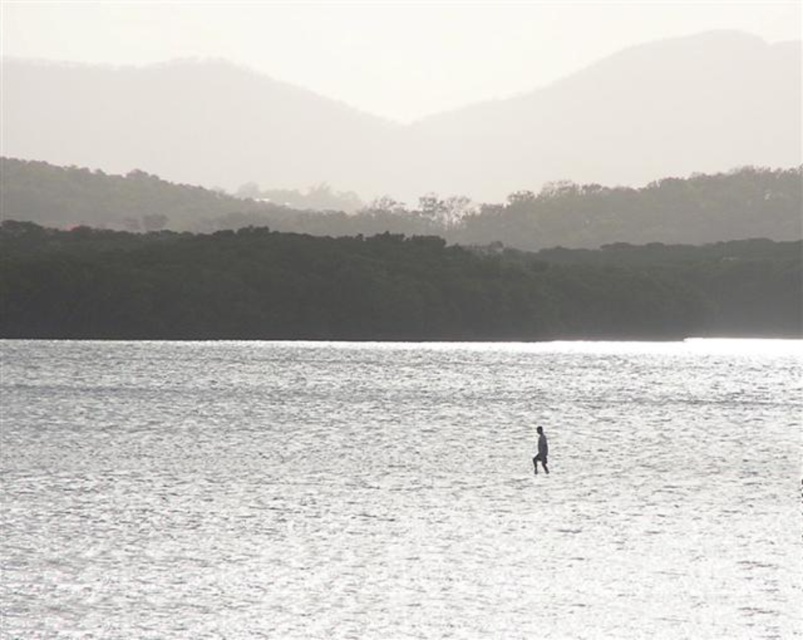
You are a photographer trying to capture the smooth skin figure at center in the clear water at center. Which object should you focus on first to ensure the figure is sharp in your photo?

The clear water at center is larger in size than the smooth skin figure at center, so you should focus on the clear water at center first to ensure the figure is sharp.

You are a photographer trying to capture the smooth skin figure at center in the clear water at center. Since the water is wider than the figure, can you frame the shot so that the figure is centered within the water? Explain how the width difference affects the composition.

The clear water at center is wider than the smooth skin figure at center, so yes, you can frame the shot so that the figure is centered within the water. The width difference allows space on both sides of the figure, creating a balanced composition.

You are a photographer trying to capture the smooth skin figure at center in the clear water at center. Can you see the figure through the water?

The clear water at center is positioned over smooth skin figure at center, so yes, you can see the figure through the water.